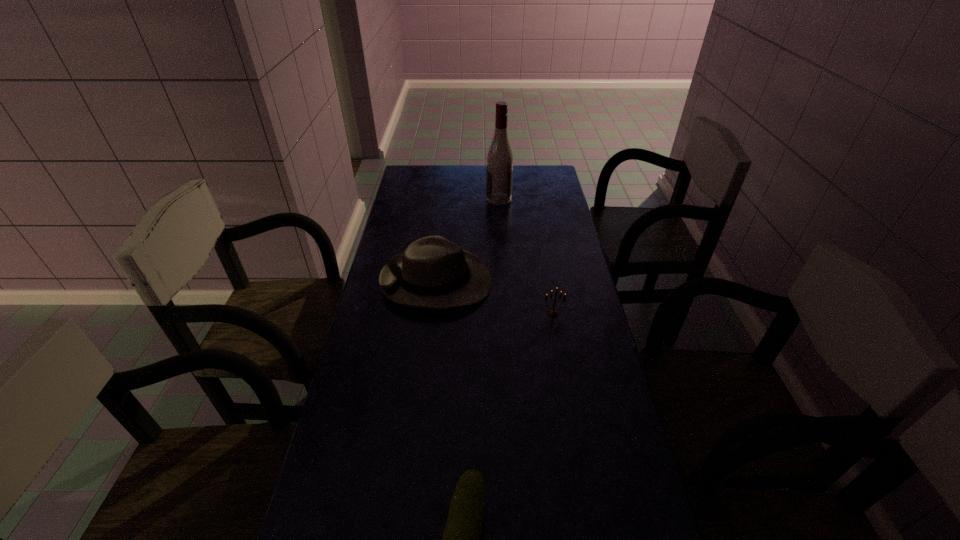
Where is `object at the right edge`? object at the right edge is located at coordinates (553, 313).

I want to click on vacant region at the far edge of the desktop, so click(x=447, y=190).

You are a GUI agent. You are given a task and a screenshot of the screen. Output one action in this format:
    pyautogui.click(x=<x>, y=<y>)
    Task: Click on the free space at the left edge of the desktop
    Image resolution: width=960 pixels, height=540 pixels.
    Given the screenshot: What is the action you would take?
    pyautogui.click(x=354, y=382)

Identify the location of free space at the right edge of the desktop. Image resolution: width=960 pixels, height=540 pixels. (560, 221).

Locate an element on the screen. This screenshot has height=540, width=960. vacant space at the far right corner of the desktop is located at coordinates (561, 187).

Where is `free space between the rightmost object and the third shortest object`? free space between the rightmost object and the third shortest object is located at coordinates (494, 298).

Where is `unoccupied position between the rightmost object and the tallest object`? The width and height of the screenshot is (960, 540). unoccupied position between the rightmost object and the tallest object is located at coordinates (526, 256).

I want to click on free spot between the tallest object and the candelabrum, so click(526, 256).

I want to click on empty space that is in between the candelabrum and the fedora, so click(x=494, y=298).

Identify the location of vacant area that lies between the alcohol and the fedora. (468, 240).